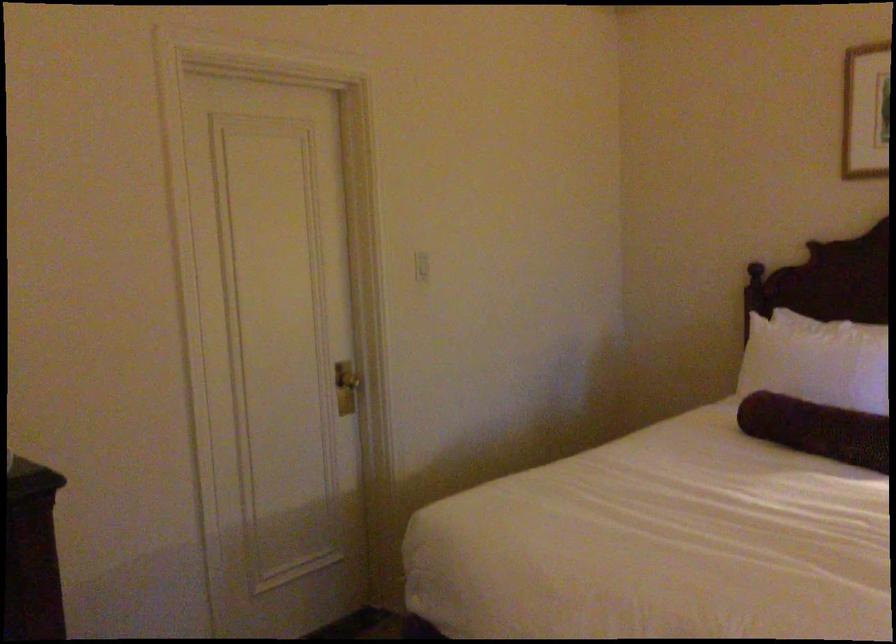
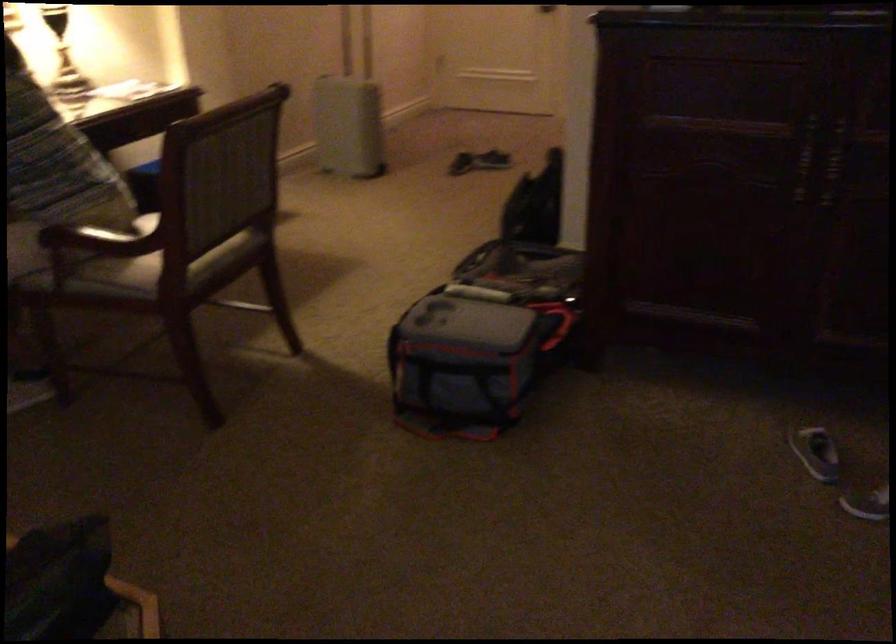
How did the camera likely rotate?

The rotation direction of the camera is left-down.